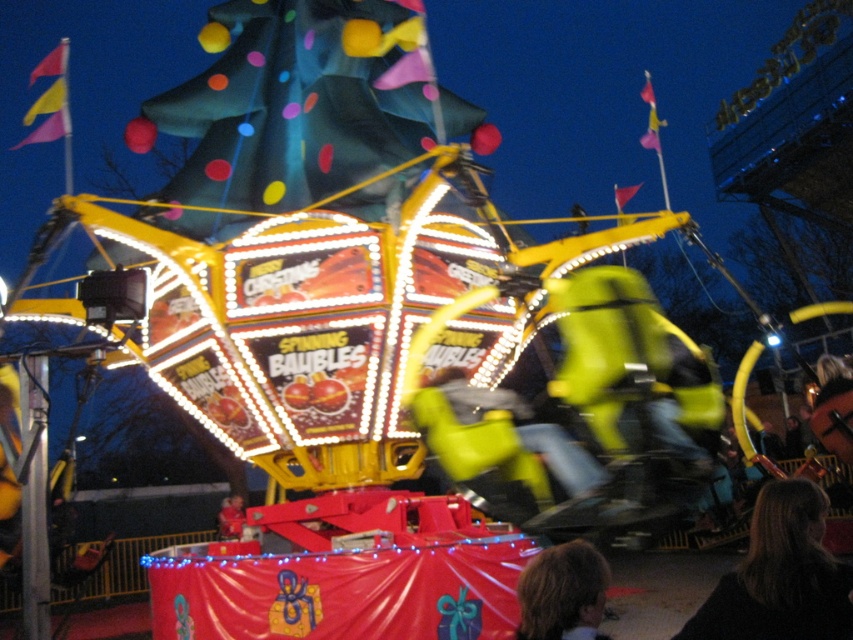
Question: Does brown hair at lower center have a greater width compared to smooth red shirt at lower center?

Choices:
 (A) yes
 (B) no

Answer: (B)

Question: Which point is farther to the camera?

Choices:
 (A) (235, 520)
 (B) (759, 568)

Answer: (A)

Question: Is brown hair at lower center in front of smooth red shirt at lower center?

Choices:
 (A) no
 (B) yes

Answer: (B)

Question: Is brown hair at lower center wider than smooth red shirt at lower center?

Choices:
 (A) no
 (B) yes

Answer: (A)

Question: Which of the following is the farthest from the observer?

Choices:
 (A) smooth red shirt at lower center
 (B) brown hair at lower center

Answer: (A)

Question: Which point appears closest to the camera in this image?

Choices:
 (A) (241, 502)
 (B) (547, 580)

Answer: (B)